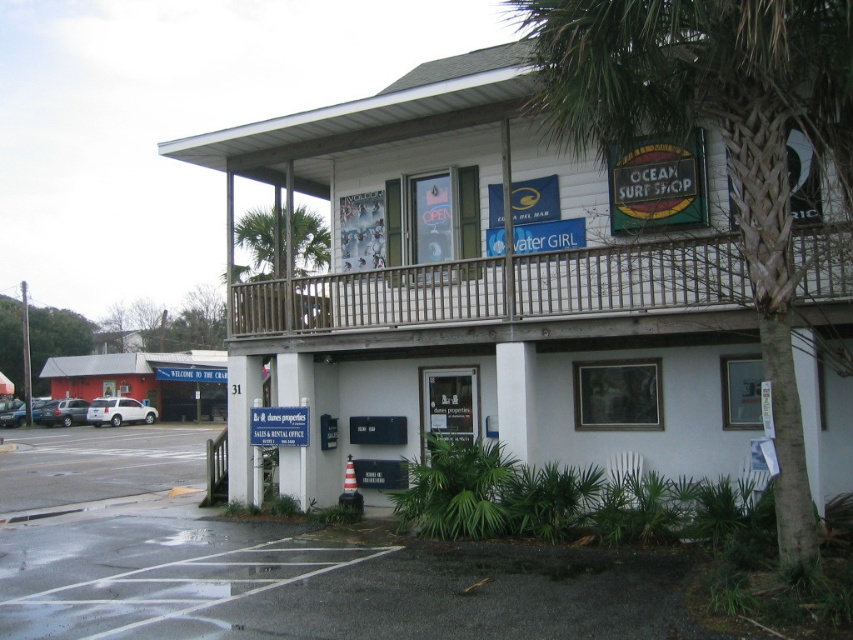
You are a delivery person trying to deliver a package to the Ocean Surf Shop. You notice two items above the entrance area. Which item is thinner between the wooden at upper center and the white plastic sign at center?

The wooden at upper center is thinner than the white plastic sign at center.

You are standing at the entrance of the Ocean Surf Shop. Looking towards the white wood building at center, which is marked by the point at coordinate (x=482, y=289), can you determine the direction you need to face to see the building?

The point at coordinate (x=482, y=289) indicates the white wood building at center, so facing towards the center from the entrance of the Ocean Surf Shop will allow you to see the building.